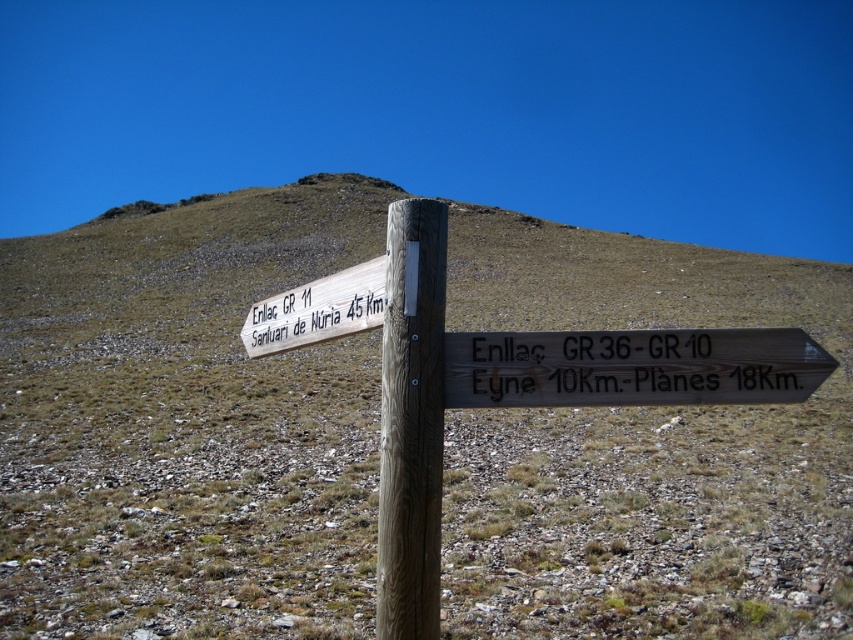
Question: Is brown wood post at center below wooden sign at upper left?

Choices:
 (A) no
 (B) yes

Answer: (B)

Question: Is wooden signpost at center below weathered wood sign at center?

Choices:
 (A) no
 (B) yes

Answer: (B)

Question: Based on their relative distances, which object is nearer to the brown wood post at center?

Choices:
 (A) wooden sign at upper left
 (B) wooden signpost at center

Answer: (A)

Question: Which point is closer to the camera taking this photo?

Choices:
 (A) (311, 294)
 (B) (399, 339)

Answer: (B)

Question: Does weathered wood sign at center have a smaller size compared to brown wood post at center?

Choices:
 (A) no
 (B) yes

Answer: (B)

Question: Which point appears farthest from the camera in this image?

Choices:
 (A) (312, 332)
 (B) (418, 257)
 (C) (741, 362)

Answer: (A)